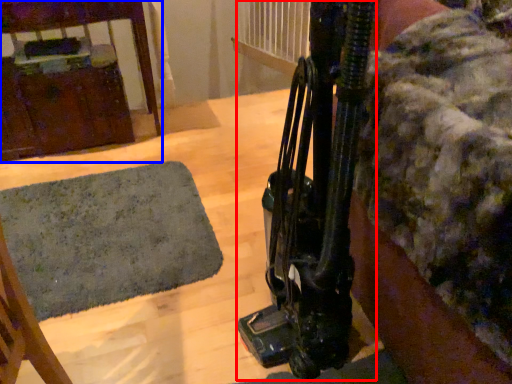
Question: Among these objects, which one is farthest to the camera, equipment (highlighted by a red box) or furniture (highlighted by a blue box)?

Choices:
 (A) equipment
 (B) furniture

Answer: (B)